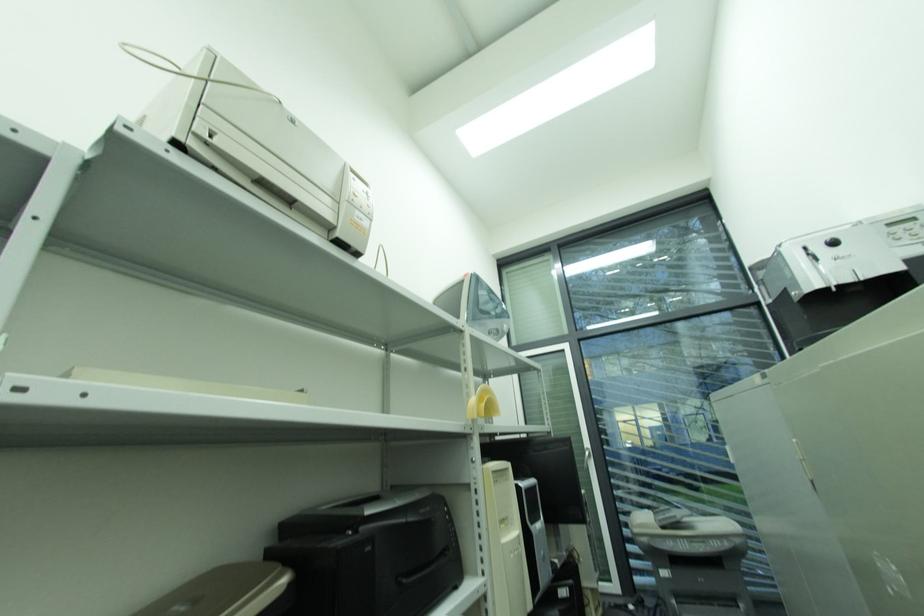
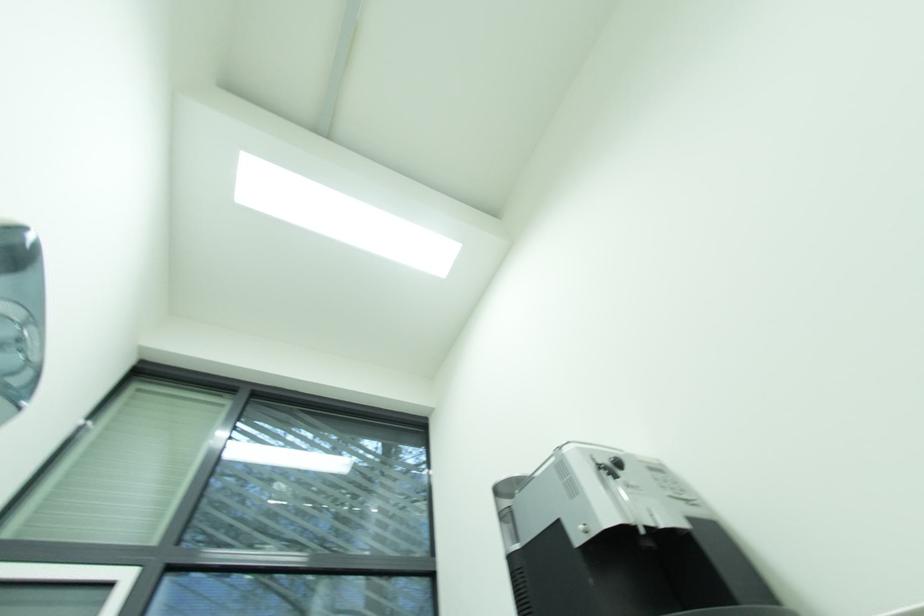
The first image is from the beginning of the video and the second image is from the end. How did the camera likely rotate when shooting the video?

The camera rotated toward right-up.